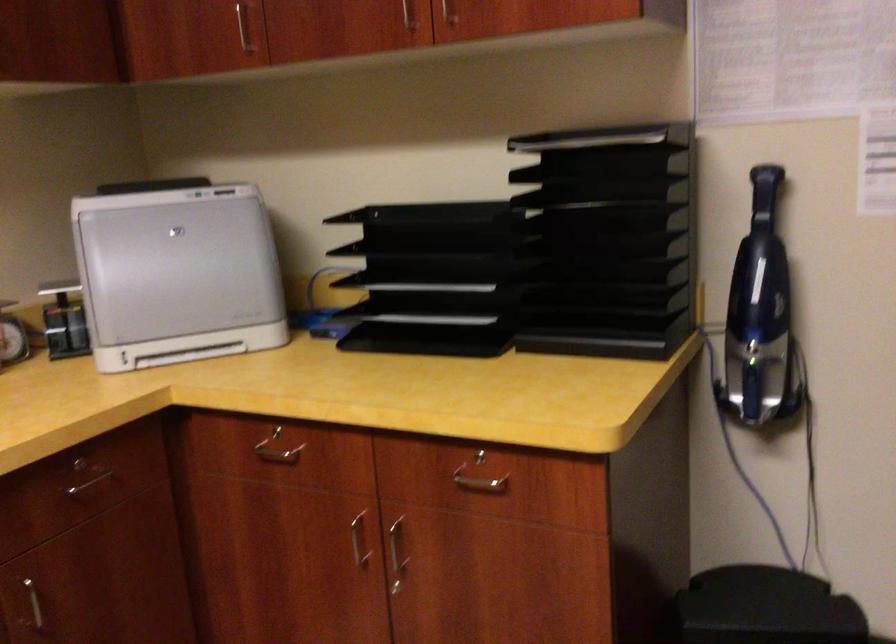
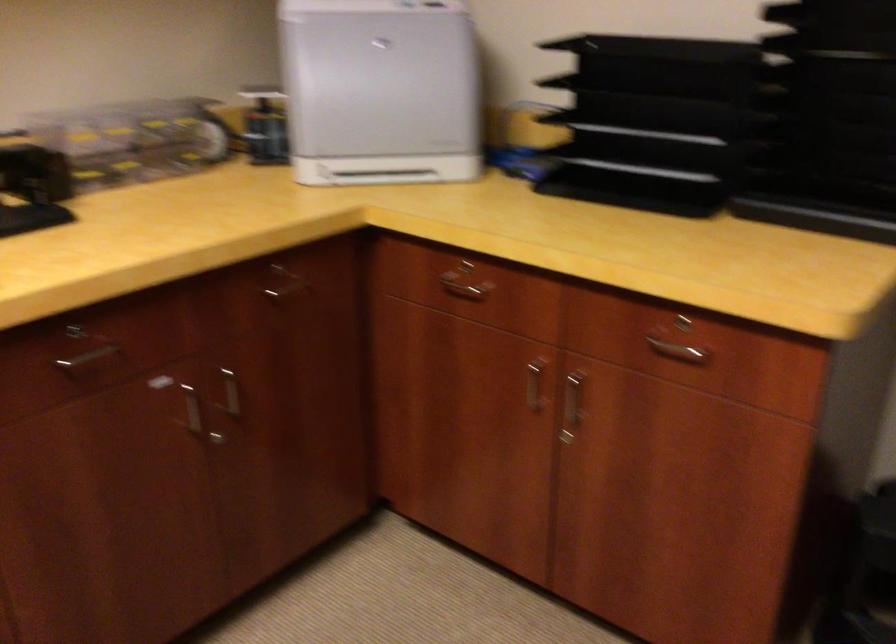
Find the pixel in the second image that matches [359,540] in the first image.

(533, 386)